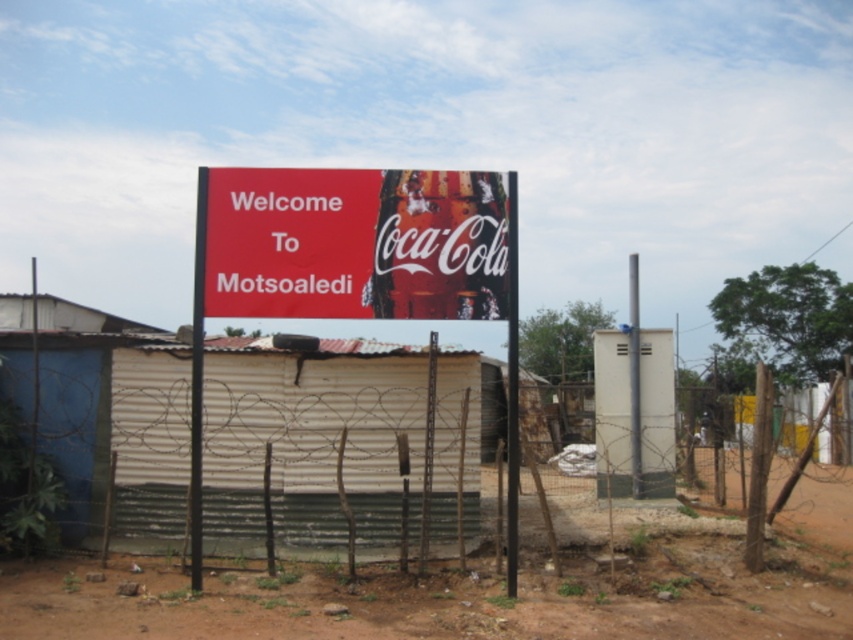
Question: Among these points, which one is nearest to the camera?

Choices:
 (A) (440, 186)
 (B) (213, 384)
 (C) (341, 170)

Answer: (A)

Question: From the image, what is the correct spatial relationship of brown dirt field at center in relation to matte red coca-cola can at center?

Choices:
 (A) right
 (B) left

Answer: (A)

Question: Among these objects, which one is farthest from the camera?

Choices:
 (A) matte red coca-cola can at center
 (B) rusty wire fence at center
 (C) brown dirt field at center

Answer: (B)

Question: Does rusty wire fence at center appear on the left side of brown dirt field at center?

Choices:
 (A) no
 (B) yes

Answer: (B)

Question: Does brown dirt field at center have a lesser width compared to matte red coca-cola can at center?

Choices:
 (A) no
 (B) yes

Answer: (A)

Question: Which object appears closest to the camera in this image?

Choices:
 (A) brown dirt field at center
 (B) red matte signboard at center
 (C) matte red coca-cola can at center
 (D) rusty wire fence at center

Answer: (A)